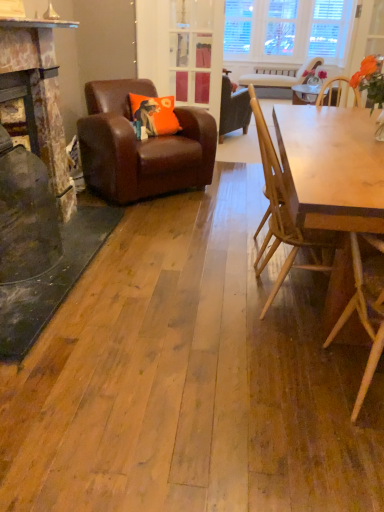
Locate an element on the screen. The image size is (384, 512). brown leather armchair at left, which is the 2th chair in back-to-front order is located at coordinates (141, 146).

Describe the element at coordinates (155, 114) in the screenshot. I see `orange fabric pillow at center-left` at that location.

Find the location of a particular element. The height and width of the screenshot is (512, 384). light brown wooden chair at right, acting as the second chair starting from the right is located at coordinates (365, 308).

In order to face light brown wooden chair at right, acting as the second chair starting from the right, should I rotate leftwards or rightwards?

To face it directly, rotate right by 26.090 degrees.

This screenshot has width=384, height=512. In order to click on brown leather armchair at left, the fourth chair from the right in this screenshot , I will do `click(141, 146)`.

From a real-world perspective, which is physically below, clear glass door at center or brown leather armchair at left, which is the 2th chair in back-to-front order?

In real-world perspective, brown leather armchair at left, which is the 2th chair in back-to-front order, is lower.

Based on the photo, considering the sizes of objects clear glass door at center and brown leather armchair at left, which is the first chair from left to right, in the image provided, who is bigger, clear glass door at center or brown leather armchair at left, which is the first chair from left to right,?

brown leather armchair at left, which is the first chair from left to right.

Is clear glass door at center inside or outside of brown leather armchair at left, the 2th chair from the top?

clear glass door at center is located beyond the bounds of brown leather armchair at left, the 2th chair from the top.

From a real-world perspective, relative to light brown wooden chair at right, acting as the second chair starting from the right, is brown leather armchair at left, which is the 3th chair from front to back, vertically above or below?

In terms of real-world spatial position, brown leather armchair at left, which is the 3th chair from front to back, is below light brown wooden chair at right, acting as the second chair starting from the right.

Could you tell me if brown leather armchair at left, the 2th chair from the top, is turned towards light brown wooden chair at right, the 4th chair when ordered from top to bottom?

Yes, brown leather armchair at left, the 2th chair from the top, is aimed at light brown wooden chair at right, the 4th chair when ordered from top to bottom.

Is brown leather armchair at left, which is the 2th chair in back-to-front order, far from light brown wooden chair at right, acting as the fourth chair starting from the back?

Yes, brown leather armchair at left, which is the 2th chair in back-to-front order, and light brown wooden chair at right, acting as the fourth chair starting from the back, are quite far apart.

Which of these two, wooden chair at right, the third chair when ordered from right to left, or orange fabric pillow at center-left, stands taller?

wooden chair at right, the third chair when ordered from right to left.

Is wooden chair at right, the 3th chair in the back-to-front sequence, oriented towards orange fabric pillow at center-left?

No, wooden chair at right, the 3th chair in the back-to-front sequence, is not oriented towards orange fabric pillow at center-left.

Which is less distant, (x=271, y=224) or (x=163, y=131)?

Point (x=271, y=224) is positioned closer to the camera compared to point (x=163, y=131).

Is orange fabric pillow at center-left surrounding light brown wooden chair at right, acting as the second chair starting from the right?

No, orange fabric pillow at center-left does not contain light brown wooden chair at right, acting as the second chair starting from the right.

Are orange fabric pillow at center-left and light brown wooden chair at right, acting as the fourth chair starting from the back, located far from each other?

Yes, orange fabric pillow at center-left is far from light brown wooden chair at right, acting as the fourth chair starting from the back.

Could you tell me if orange fabric pillow at center-left is turned towards light brown wooden chair at right, acting as the second chair starting from the right?

Yes, orange fabric pillow at center-left faces towards light brown wooden chair at right, acting as the second chair starting from the right.

From the image's perspective, is orange fabric pillow at center-left on light brown wooden chair at right, acting as the fourth chair starting from the back?

Yes, from the image's perspective, orange fabric pillow at center-left is on top of light brown wooden chair at right, acting as the fourth chair starting from the back.

Which object is positioned more to the right, clear glass door at center or light beige wood chair at upper center, the first chair positioned from the top?

light beige wood chair at upper center, the first chair positioned from the top.

Is point (185, 64) positioned in front of point (299, 76)?

That is True.

From a real-world perspective, between clear glass door at center and light beige wood chair at upper center, the first chair from the right, who is vertically higher?

From a 3D spatial view, clear glass door at center is above.

Considering the relative sizes of clear glass door at center and light beige wood chair at upper center, placed as the fourth chair when sorted from front to back, in the image provided, is clear glass door at center bigger than light beige wood chair at upper center, placed as the fourth chair when sorted from front to back,?

Actually, clear glass door at center might be smaller than light beige wood chair at upper center, placed as the fourth chair when sorted from front to back.

From a real-world perspective, is light brown wooden table at right positioned under orange fabric pillow at center-left based on gravity?

Correct, in the physical world, light brown wooden table at right is lower than orange fabric pillow at center-left.

Is light brown wooden table at right far away from orange fabric pillow at center-left?

Yes, light brown wooden table at right and orange fabric pillow at center-left are quite far apart.

Considering the relative sizes of light brown wooden table at right and orange fabric pillow at center-left in the image provided, is light brown wooden table at right thinner than orange fabric pillow at center-left?

No.

Is light brown wooden table at right completely or partially outside of orange fabric pillow at center-left?

Yes, light brown wooden table at right is located beyond the bounds of orange fabric pillow at center-left.

Which is closer to the camera, (315, 129) or (377, 333)?

The point (377, 333) is closer to the camera.

Locate an element on the screen. the 2nd chair counting from the right side of the light brown wooden table at right is located at coordinates pyautogui.click(x=365, y=308).

From a real-world perspective, which object stands above the other?

From a 3D spatial view, light brown wooden chair at right, which is the 1th chair in front-to-back order, is above.

Considering the sizes of light brown wooden table at right and light brown wooden chair at right, arranged as the 3th chair when viewed from the left, in the image, is light brown wooden table at right wider or thinner than light brown wooden chair at right, arranged as the 3th chair when viewed from the left,?

In the image, light brown wooden table at right appears to be more narrow than light brown wooden chair at right, arranged as the 3th chair when viewed from the left.

Locate an element on the screen. This screenshot has height=512, width=384. the 4th chair positioned below the clear glass door at center (from a real-world perspective) is located at coordinates (141, 146).

Starting from the light brown wooden chair at right, acting as the second chair starting from the right, which chair is the 2nd one behind? Please provide its 2D coordinates.

[(141, 146)]

Based on their spatial positions, is light brown wooden table at right or brown leather armchair at left, the 3th chair ordered from the bottom, closer to light beige wood chair at upper center, which ranks as the 4th chair in left-to-right order?

Among the two, brown leather armchair at left, the 3th chair ordered from the bottom, is located nearer to light beige wood chair at upper center, which ranks as the 4th chair in left-to-right order.

When comparing their distances from light beige wood chair at upper center, the fourth chair ordered from the bottom, does light brown wooden table at right or clear glass door at center seem closer?

Among the two, clear glass door at center is located nearer to light beige wood chair at upper center, the fourth chair ordered from the bottom.

Looking at the image, which one is located closer to clear glass door at center, brown leather armchair at left, which is the 2th chair in back-to-front order, or light brown wooden table at right?

Among the two, brown leather armchair at left, which is the 2th chair in back-to-front order, is located nearer to clear glass door at center.

Looking at the image, which one is located closer to clear glass door at center, light brown wooden chair at right, acting as the fourth chair starting from the back, or orange fabric pillow at center-left?

orange fabric pillow at center-left is positioned closer to the anchor clear glass door at center.

Based on their spatial positions, is orange fabric pillow at center-left or light brown wooden chair at right, the 4th chair when ordered from top to bottom, closer to clear glass door at center?

orange fabric pillow at center-left is closer to clear glass door at center.

Looking at the image, which one is located further to light brown wooden chair at right, acting as the second chair starting from the right, clear glass door at center or orange fabric pillow at center-left?

clear glass door at center.

When comparing their distances from orange fabric pillow at center-left, does light brown wooden table at right or light beige wood chair at upper center, placed as the fourth chair when sorted from front to back, seem closer?

light brown wooden table at right is closer to orange fabric pillow at center-left.

From the image, which object appears to be nearer to orange fabric pillow at center-left, light brown wooden chair at right, which is the 1th chair in front-to-back order, or clear glass door at center?

clear glass door at center lies closer to orange fabric pillow at center-left than the other object.

Find the location of a particular element. Image resolution: width=384 pixels, height=512 pixels. glass door between light brown wooden chair at right, positioned as the 1th chair in bottom-to-top order, and light beige wood chair at upper center, the first chair from the right, from front to back is located at coordinates (196, 53).

Locate an element on the screen. Image resolution: width=384 pixels, height=512 pixels. glass door located between orange fabric pillow at center-left and light beige wood chair at upper center, the fourth chair ordered from the bottom, in the depth direction is located at coordinates (196, 53).

Locate an element on the screen. The width and height of the screenshot is (384, 512). round table between light brown wooden chair at right, acting as the fourth chair starting from the back, and wooden chair at right, arranged as the second chair when viewed from the front, from front to back is located at coordinates (332, 183).

Where is `chair positioned between wooden chair at right, the third chair when ordered from right to left, and orange fabric pillow at center-left from near to far`? The height and width of the screenshot is (512, 384). chair positioned between wooden chair at right, the third chair when ordered from right to left, and orange fabric pillow at center-left from near to far is located at coordinates (141, 146).